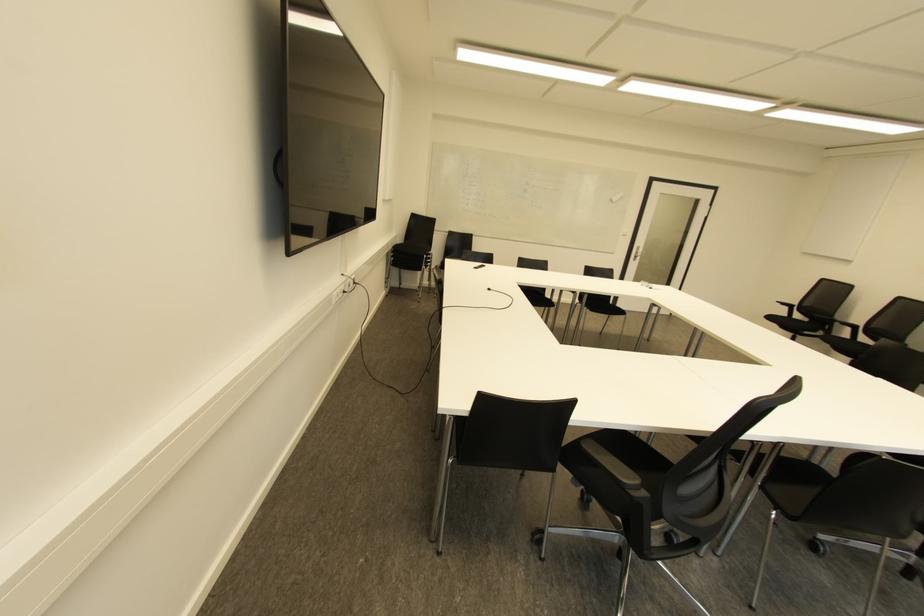
This screenshot has height=616, width=924. What do you see at coordinates (344, 289) in the screenshot?
I see `a white wall socket` at bounding box center [344, 289].